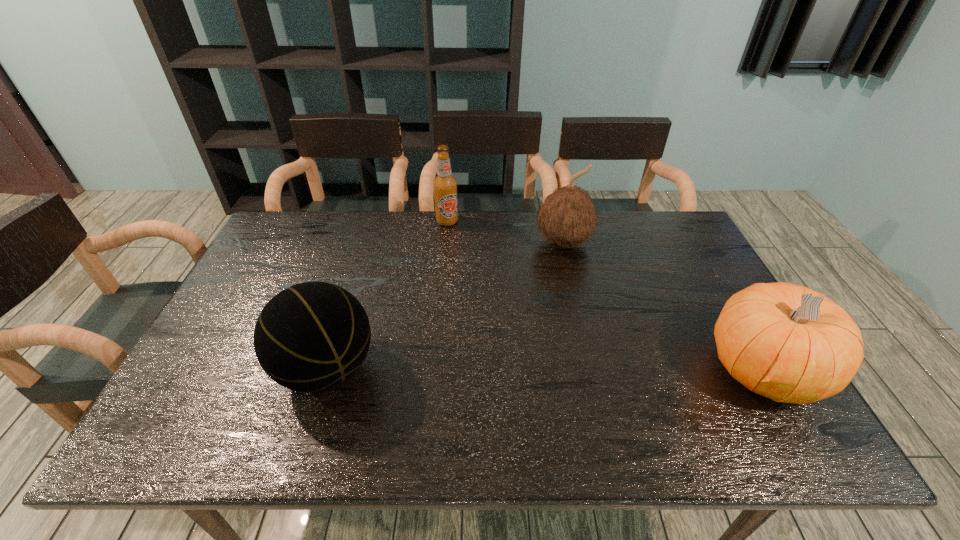
Locate an element on the screen. This screenshot has width=960, height=540. free space that satisfies the following two spatial constraints: 1. on the front side of the beer bottle; 2. on the front-facing side of the rightmost object is located at coordinates (433, 370).

Find the location of a particular element. This screenshot has height=540, width=960. vacant space that satisfies the following two spatial constraints: 1. on the front side of the pumpkin; 2. on the front-facing side of the second object from left to right is located at coordinates (433, 370).